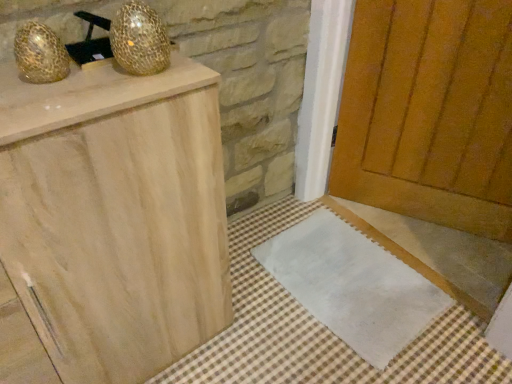
Locate an element on the screen. vacant space situated on the left part of white fabric doormat at lower center is located at coordinates (248, 292).